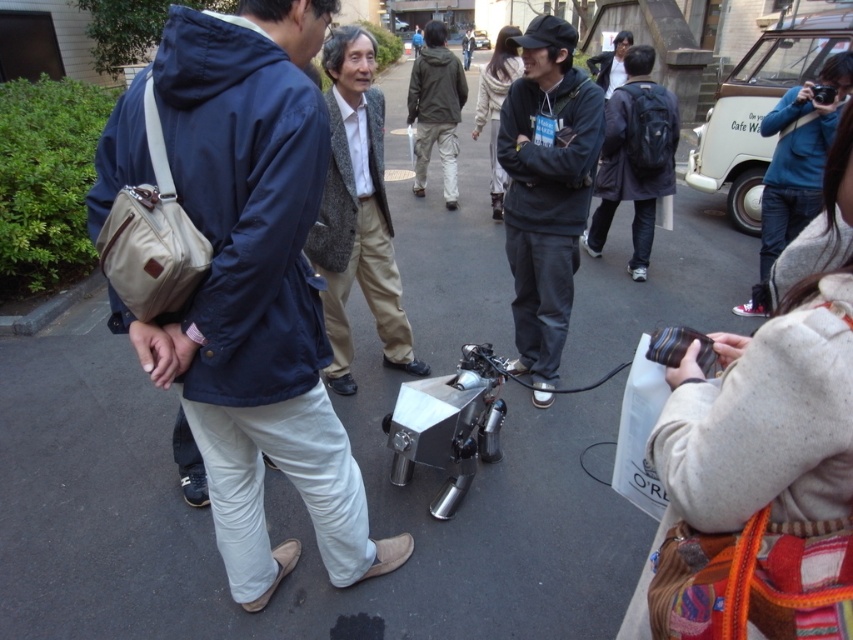
Question: Which point appears closest to the camera in this image?

Choices:
 (A) (368, 257)
 (B) (556, 58)
 (C) (822, 148)

Answer: (B)

Question: Which point is closer to the camera?

Choices:
 (A) (526, 99)
 (B) (669, 113)

Answer: (A)

Question: Which of these objects is positioned closest to the matte blue jacket at center?

Choices:
 (A) dark gray hoodie at center
 (B) metallic silver robot at center
 (C) black plastic camera at upper right

Answer: (B)

Question: In this image, where is matte blue jacket at center located relative to black plastic camera at upper right?

Choices:
 (A) above
 (B) below

Answer: (B)

Question: Can you confirm if metallic silver robot at center is positioned to the right of black plastic camera at upper right?

Choices:
 (A) no
 (B) yes

Answer: (A)

Question: Considering the relative positions of matte blue jacket at center and blue denim jacket at upper right in the image provided, where is matte blue jacket at center located with respect to blue denim jacket at upper right?

Choices:
 (A) left
 (B) right

Answer: (A)